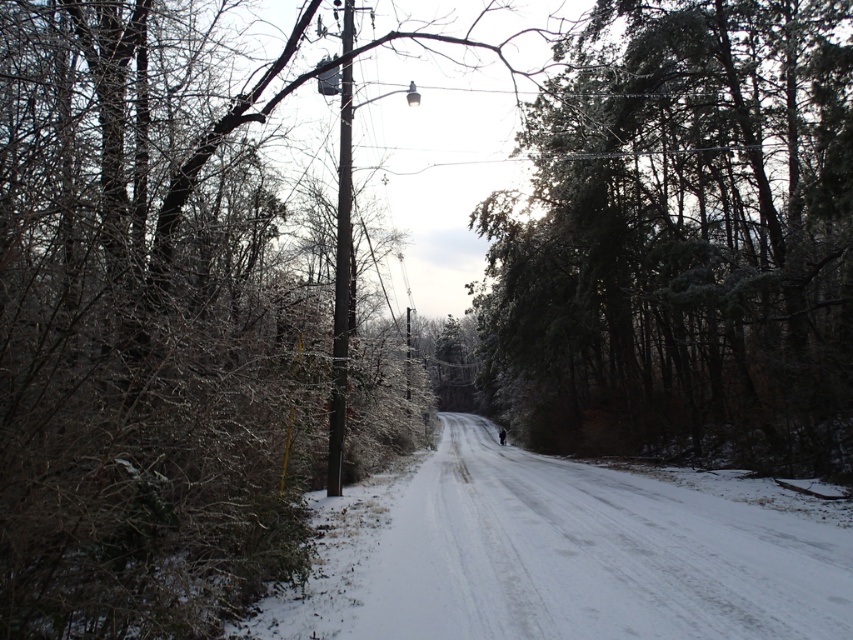
You are a bird flying over a snow covered road. You see a green textured tree at center and a brown wooden pole at center. Which one can you see the top of first as you approach the road?

The green textured tree at center is much taller as brown wooden pole at center, so you will see the top of the green textured tree at center first as you approach the road.

You are a hiker trying to navigate through the snow. You see a green textured tree at center and a brown wooden pole at center. Which object is positioned to the right side from your perspective?

The green textured tree at center is to the right of the brown wooden pole at center.

From the picture: You are standing on the snow covered road and want to reach the point at coordinates (616, 371). The snowmobile you are driving has a maximum range of 50 meters. Can you safely reach the point without needing to refuel?

The point at (616, 371) is 45.50 meters away from the viewer. Since the snowmobile has a maximum range of 50 meters, you can safely reach the point without needing to refuel.